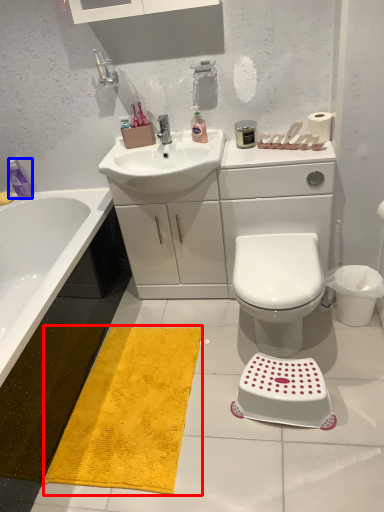
Question: Which point is further to the camera, doormat (highlighted by a red box) or toiletry (highlighted by a blue box)?

Choices:
 (A) doormat
 (B) toiletry

Answer: (B)